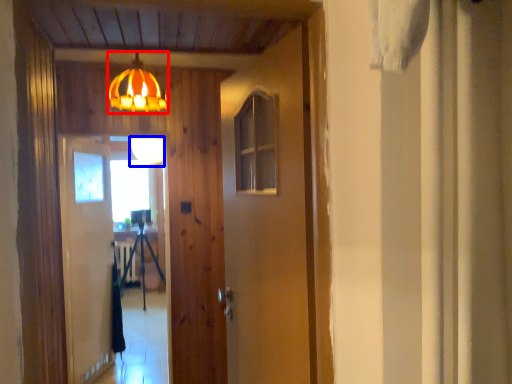
Question: Which object is further to the camera taking this photo, lamp (highlighted by a red box) or lamp (highlighted by a blue box)?

Choices:
 (A) lamp
 (B) lamp

Answer: (B)